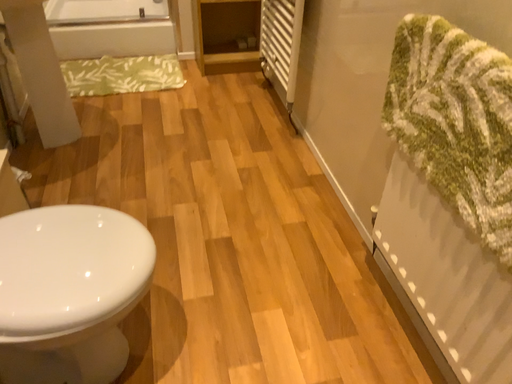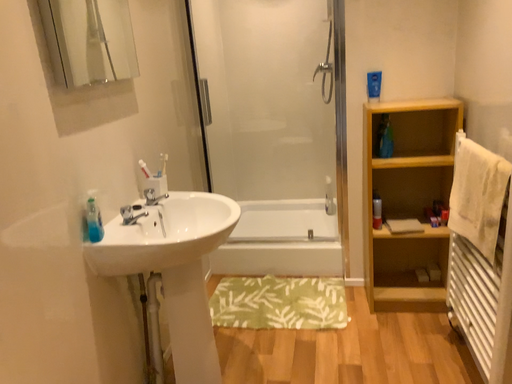
Question: Which way did the camera rotate in the video?

Choices:
 (A) rotated left
 (B) rotated right

Answer: (A)